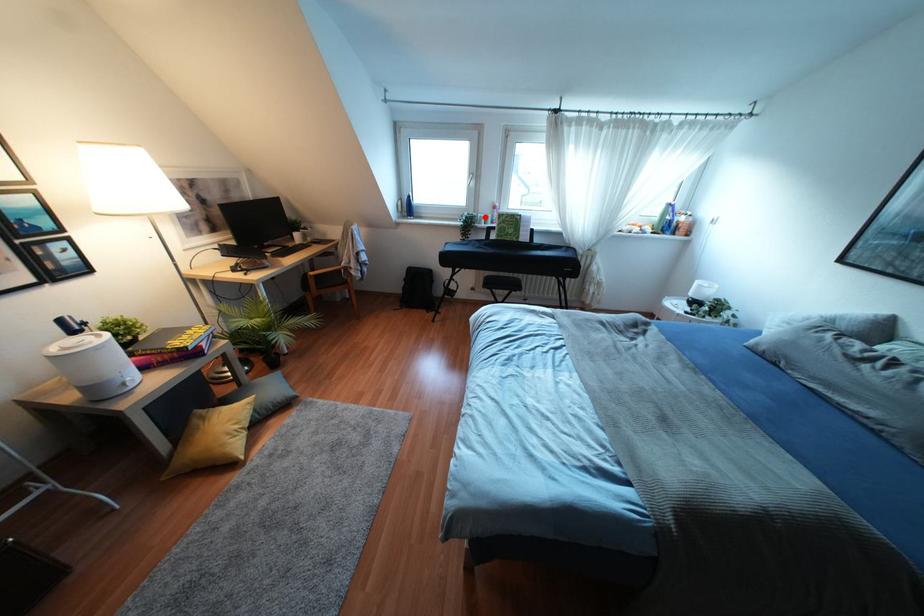
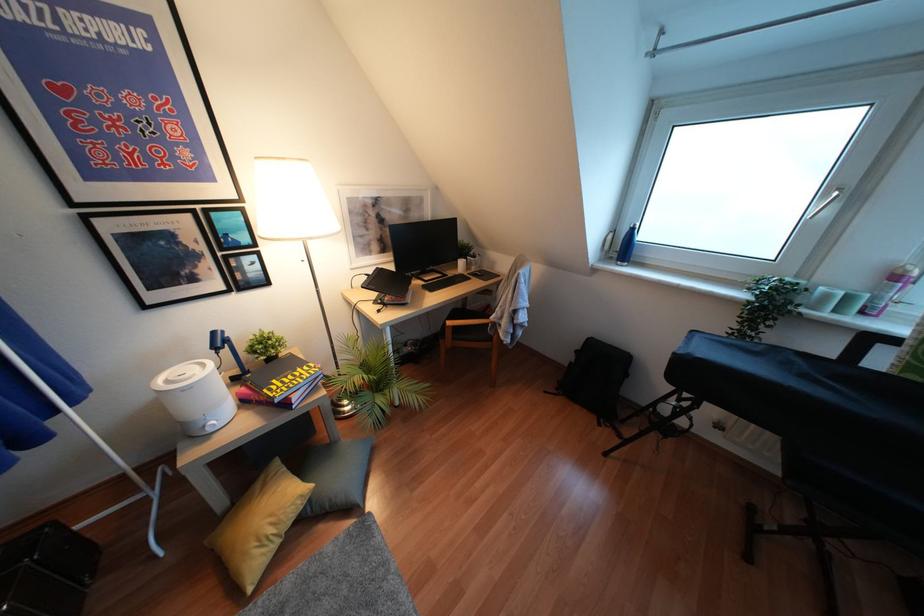
In the second image, find the point that corresponds to the highlighted location in the first image.

(846, 298)